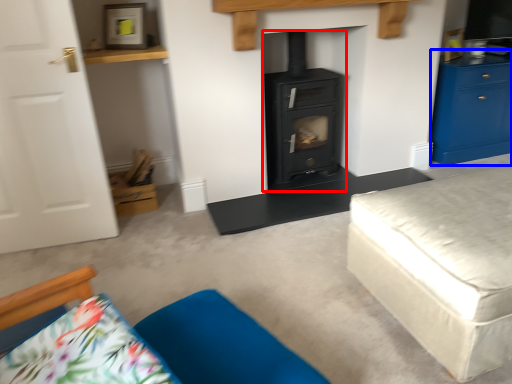
Question: Which object appears farthest to the camera in this image, wood burning stove (highlighted by a red box) or chest of drawers (highlighted by a blue box)?

Choices:
 (A) wood burning stove
 (B) chest of drawers

Answer: (B)